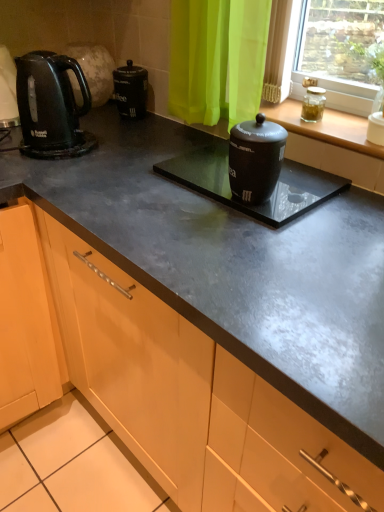
Question: Is clear glass jar at upper right, which ranks as the 1th appliance in top-to-bottom order, outside matte black kettle at left?

Choices:
 (A) yes
 (B) no

Answer: (A)

Question: Is clear glass jar at upper right, the 2th appliance in the bottom-to-top sequence, smaller than matte black kettle at left?

Choices:
 (A) yes
 (B) no

Answer: (A)

Question: From a real-world perspective, is clear glass jar at upper right, the 2th appliance in the bottom-to-top sequence, located beneath matte black kettle at left?

Choices:
 (A) no
 (B) yes

Answer: (A)

Question: Are clear glass jar at upper right, which ranks as the 1th appliance in top-to-bottom order, and matte black kettle at left beside each other?

Choices:
 (A) no
 (B) yes

Answer: (A)

Question: Is clear glass jar at upper right, the 2th appliance in the bottom-to-top sequence, to the left of matte black kettle at left from the viewer's perspective?

Choices:
 (A) yes
 (B) no

Answer: (B)

Question: Is clear glass jar at upper right, the 2th appliance in the bottom-to-top sequence, positioned with its back to matte black kettle at left?

Choices:
 (A) yes
 (B) no

Answer: (B)

Question: Considering the relative positions of transparent glass jar at upper right and black matte canister at center, the 2th appliance from the top, in the image provided, is transparent glass jar at upper right to the left of black matte canister at center, the 2th appliance from the top, from the viewer's perspective?

Choices:
 (A) yes
 (B) no

Answer: (B)

Question: Can you confirm if transparent glass jar at upper right is wider than black matte canister at center, which ranks as the 1th appliance in bottom-to-top order?

Choices:
 (A) no
 (B) yes

Answer: (A)

Question: Is transparent glass jar at upper right oriented away from black matte canister at center, the 2th appliance from the top?

Choices:
 (A) no
 (B) yes

Answer: (A)

Question: Does transparent glass jar at upper right have a greater height compared to black matte canister at center, the 2th appliance from the top?

Choices:
 (A) no
 (B) yes

Answer: (B)

Question: Is transparent glass jar at upper right at the right side of black matte canister at center, the 2th appliance from the top?

Choices:
 (A) yes
 (B) no

Answer: (A)

Question: Can we say transparent glass jar at upper right lies outside black matte canister at center, the 2th appliance from the top?

Choices:
 (A) yes
 (B) no

Answer: (A)

Question: Considering the relative sizes of transparent glass jar at upper right and clear glass jar at upper right in the image provided, is transparent glass jar at upper right taller than clear glass jar at upper right?

Choices:
 (A) yes
 (B) no

Answer: (B)